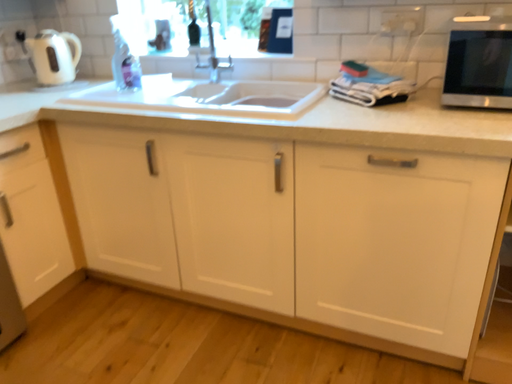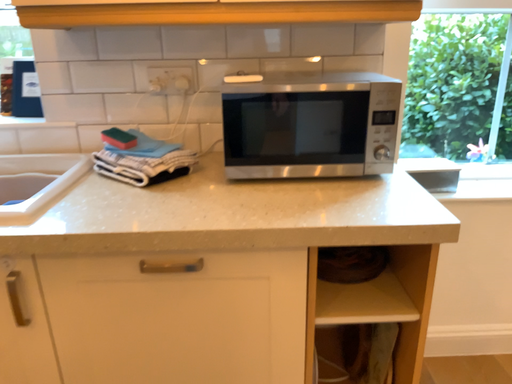
Question: Which way did the camera rotate in the video?

Choices:
 (A) rotated right
 (B) rotated left

Answer: (A)